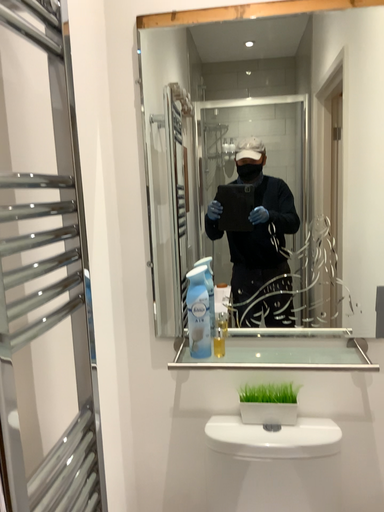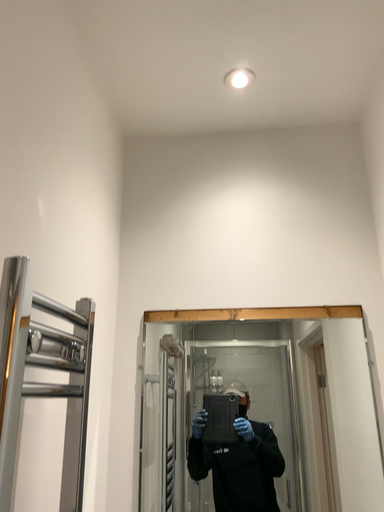
Question: How did the camera likely rotate when shooting the video?

Choices:
 (A) rotated downward
 (B) rotated upward

Answer: (B)